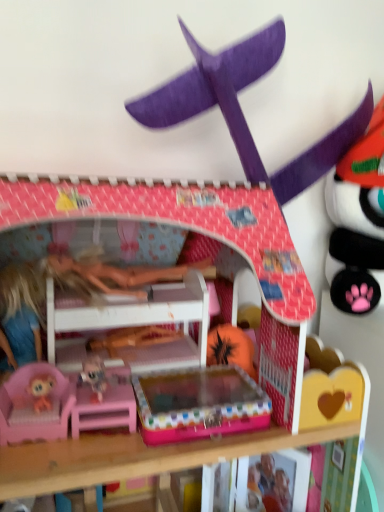
Question: Is point (291, 331) positioned closer to the camera than point (284, 199)?

Choices:
 (A) farther
 (B) closer

Answer: (B)

Question: Considering the positions of pink plastic bunk bed at center and purple cardboard airplane at upper center in the image, is pink plastic bunk bed at center taller or shorter than purple cardboard airplane at upper center?

Choices:
 (A) tall
 (B) short

Answer: (A)

Question: In the image, is pink plastic bunk bed at center positioned in front of or behind purple cardboard airplane at upper center?

Choices:
 (A) front
 (B) behind

Answer: (A)

Question: In terms of width, does purple cardboard airplane at upper center look wider or thinner when compared to pink plastic bunk bed at center?

Choices:
 (A) thin
 (B) wide

Answer: (A)

Question: From a real-world perspective, is purple cardboard airplane at upper center positioned above or below pink plastic bunk bed at center?

Choices:
 (A) below
 (B) above

Answer: (B)

Question: Does point pyautogui.click(x=367, y=96) appear closer or farther from the camera than point pyautogui.click(x=104, y=247)?

Choices:
 (A) closer
 (B) farther

Answer: (B)

Question: Looking at the image, does purple cardboard airplane at upper center seem bigger or smaller compared to pink plastic bunk bed at center?

Choices:
 (A) big
 (B) small

Answer: (B)